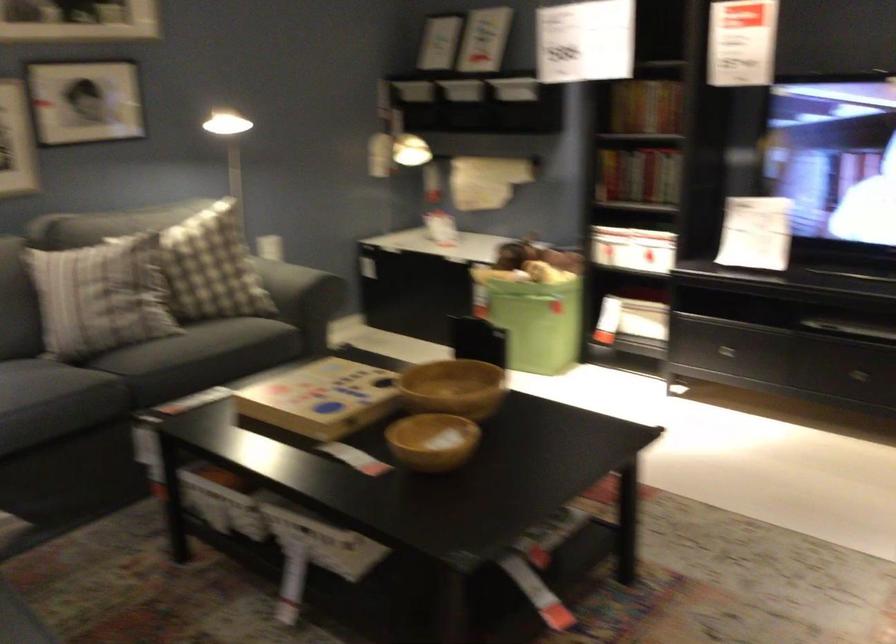
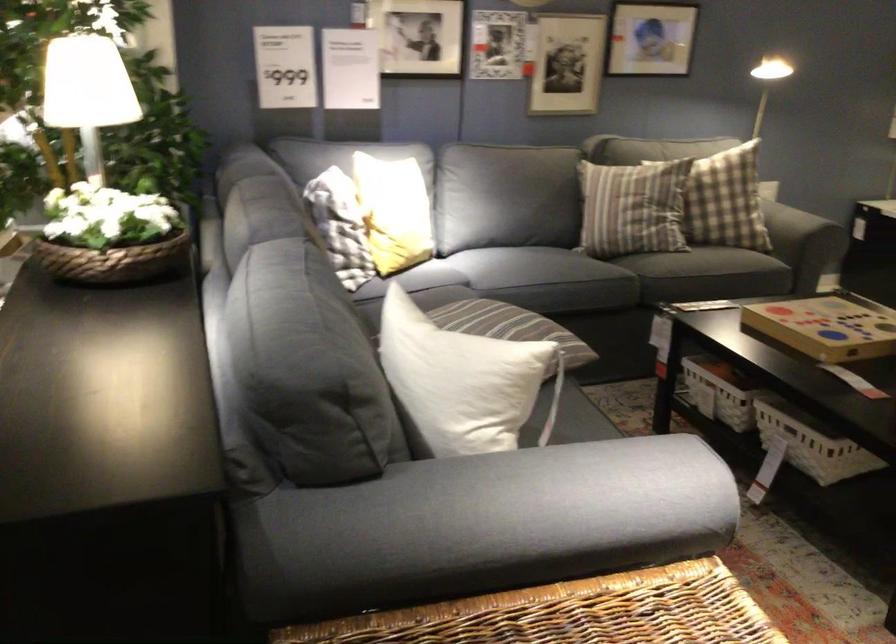
The point at (79, 310) is marked in the first image. Where is the corresponding point in the second image?

(633, 207)